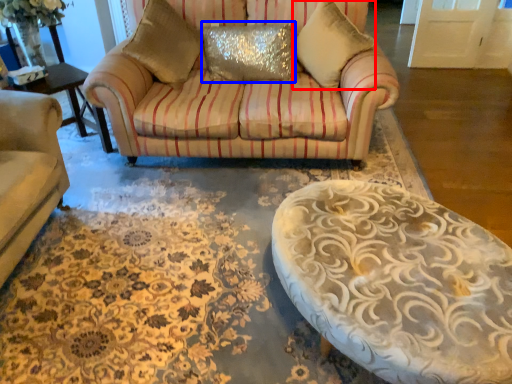
Question: Which object is closer to the camera taking this photo, pillow (highlighted by a red box) or pillow (highlighted by a blue box)?

Choices:
 (A) pillow
 (B) pillow

Answer: (A)